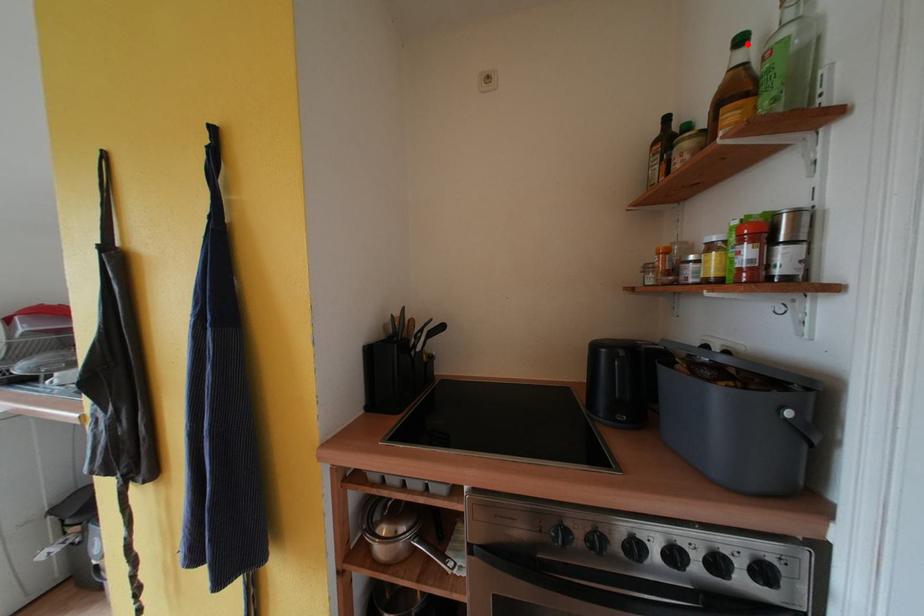
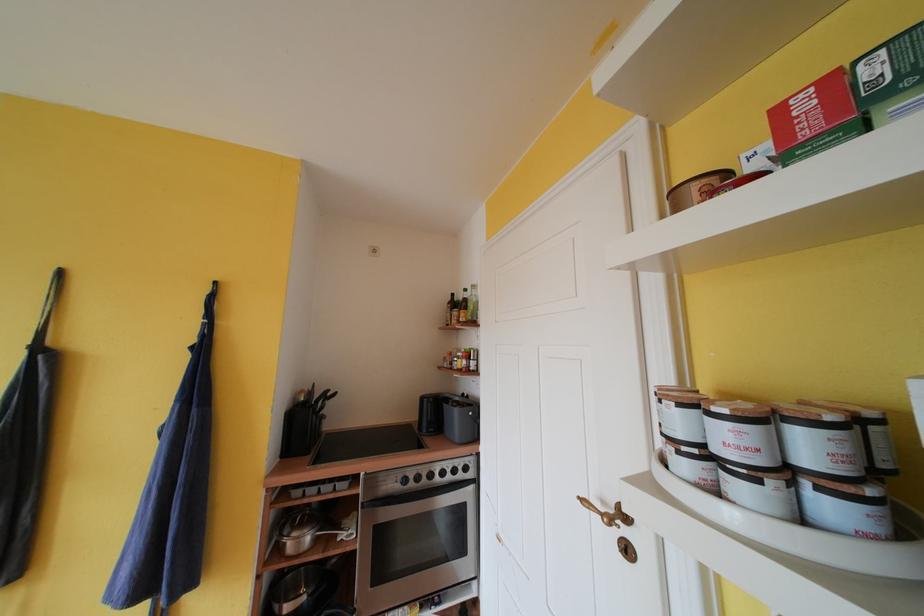
Where in the second image is the point corresponding to the highlighted location from the first image?

(471, 294)